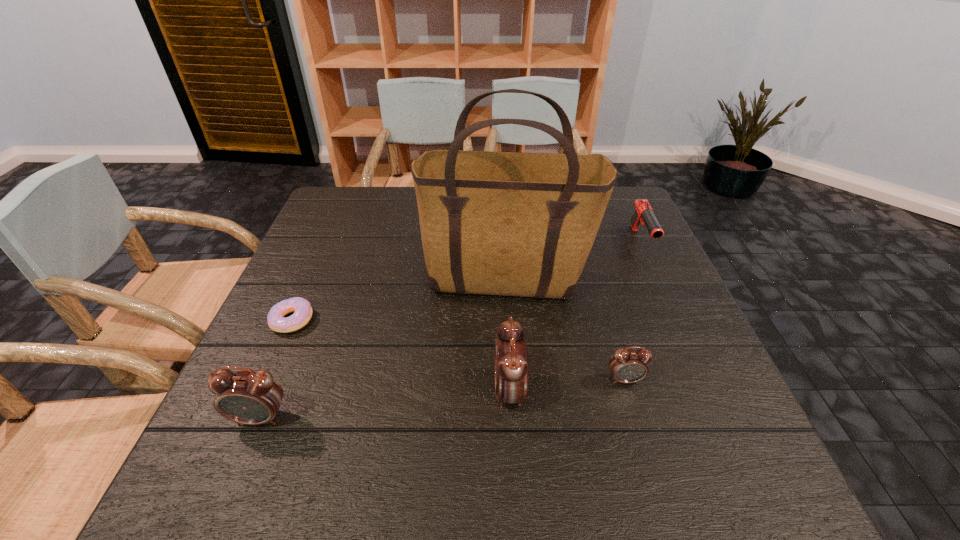
If equal spacing is the goal by inserting an additional alarm_clock among them, please point out a vacant space for this new alarm_clock. Please provide its 2D coordinates. Your answer should be formatted as a tuple, i.e. [(x, y)], where the tuple contains the x and y coordinates of a point satisfying the conditions above.

[(388, 404)]